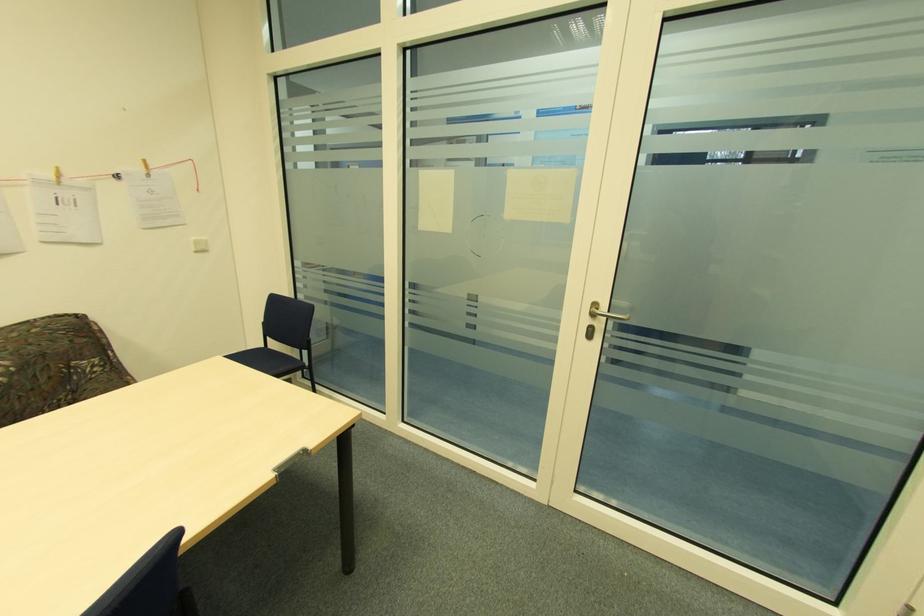
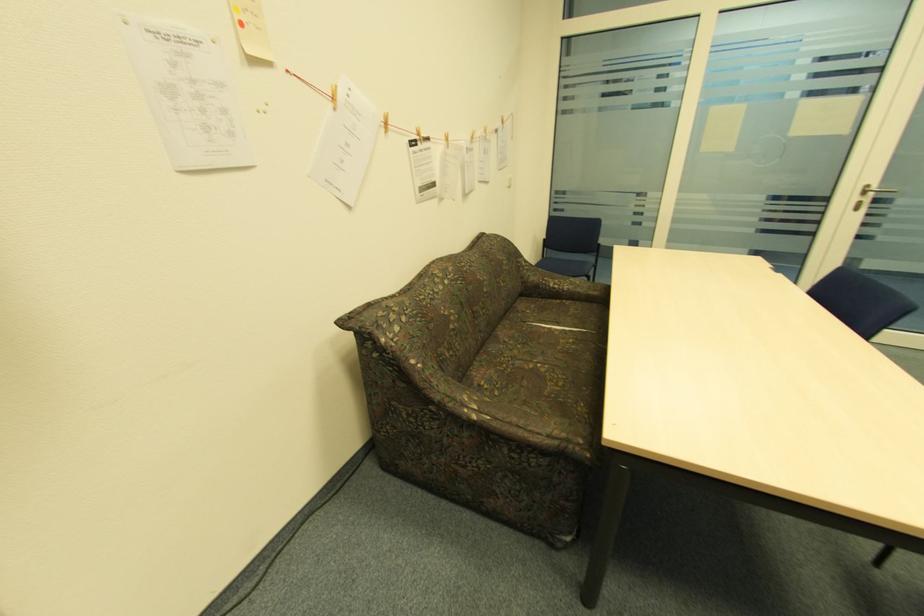
What movement of the cameraman would produce the second image?

The cameraman walked toward left, backward.